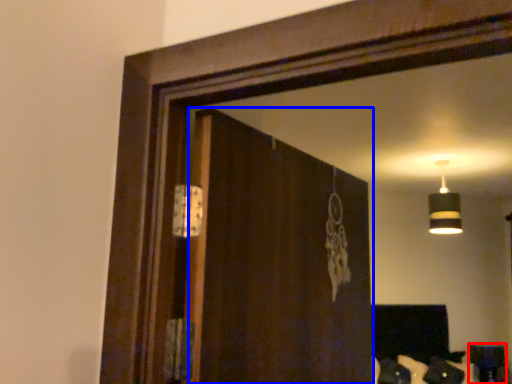
Question: Among these objects, which one is farthest to the camera, furniture (highlighted by a red box) or screen door (highlighted by a blue box)?

Choices:
 (A) furniture
 (B) screen door

Answer: (A)